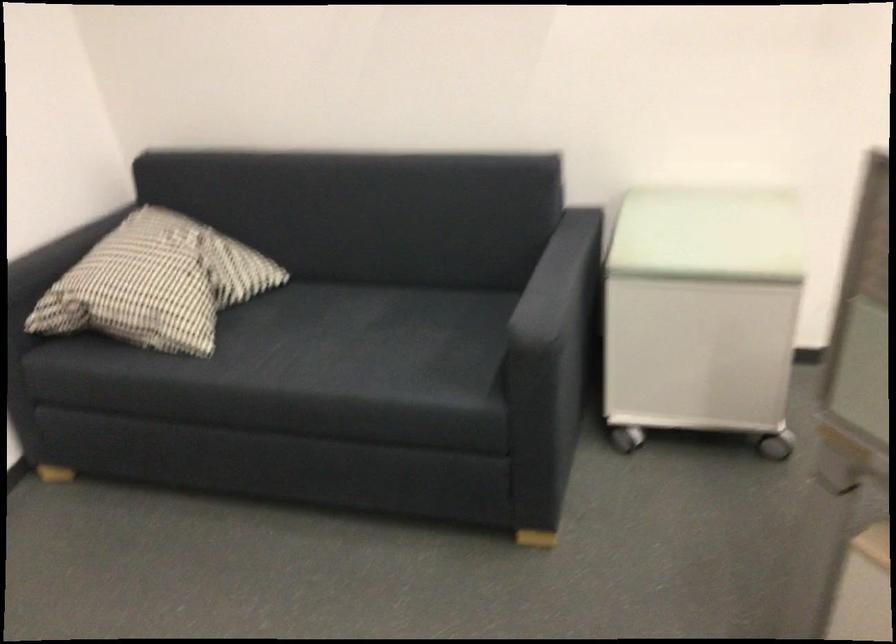
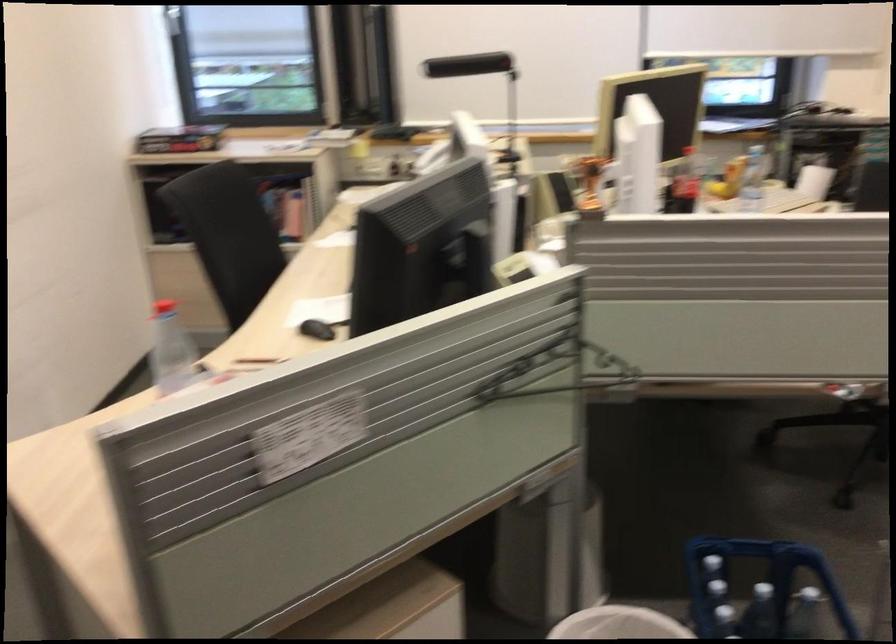
The first image is from the beginning of the video and the second image is from the end. How did the camera likely rotate when shooting the video?

The rotation direction of the camera is right-down.